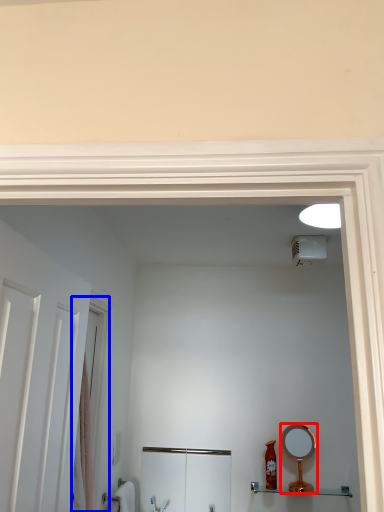
Question: Which object appears closest to the camera in this image, mirror (highlighted by a red box) or screen door (highlighted by a blue box)?

Choices:
 (A) mirror
 (B) screen door

Answer: (B)